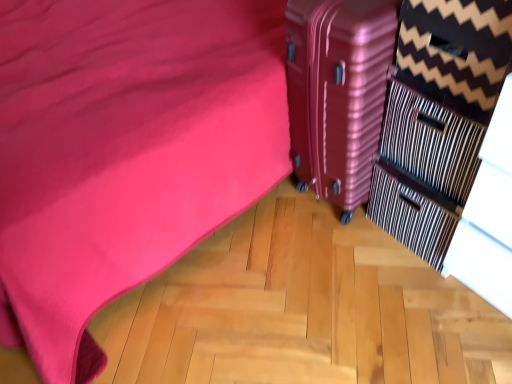
Locate an element on the screen. striped fabric dresser at right is located at coordinates (438, 118).

This screenshot has width=512, height=384. What do you see at coordinates (438, 118) in the screenshot?
I see `striped fabric dresser at right` at bounding box center [438, 118].

Measure the distance between metallic pink suitcase at right and camera.

38.86 inches.

This screenshot has width=512, height=384. Describe the element at coordinates (338, 92) in the screenshot. I see `metallic pink suitcase at right` at that location.

Locate an element on the screen. Image resolution: width=512 pixels, height=384 pixels. metallic pink suitcase at right is located at coordinates (338, 92).

You are a GUI agent. You are given a task and a screenshot of the screen. Output one action in this format:
    pyautogui.click(x=<x>, y=<y>)
    Task: Click on the striped fabric dresser at right
    This screenshot has height=384, width=512.
    Given the screenshot: What is the action you would take?
    pyautogui.click(x=438, y=118)

Looking at this image, considering the relative positions of metallic pink suitcase at right and striped fabric dresser at right in the image provided, is metallic pink suitcase at right to the left or to the right of striped fabric dresser at right?

Clearly, metallic pink suitcase at right is on the left of striped fabric dresser at right in the image.

Does metallic pink suitcase at right come behind striped fabric dresser at right?

That is True.

Does point (322, 98) appear closer or farther from the camera than point (442, 96)?

Clearly, point (322, 98) is more distant from the camera than point (442, 96).

From the image's perspective, is metallic pink suitcase at right on striped fabric dresser at right?

Yes, from the image's perspective, metallic pink suitcase at right is above striped fabric dresser at right.

From a real-world perspective, who is located lower, metallic pink suitcase at right or striped fabric dresser at right?

metallic pink suitcase at right, from a real-world perspective.

Does metallic pink suitcase at right have a greater width compared to striped fabric dresser at right?

Indeed, metallic pink suitcase at right has a greater width compared to striped fabric dresser at right.

Considering the relative sizes of metallic pink suitcase at right and striped fabric dresser at right in the image provided, is metallic pink suitcase at right shorter than striped fabric dresser at right?

In fact, metallic pink suitcase at right may be taller than striped fabric dresser at right.

Who is smaller, metallic pink suitcase at right or striped fabric dresser at right?

striped fabric dresser at right is smaller.

Looking at this image, is metallic pink suitcase at right located outside striped fabric dresser at right?

metallic pink suitcase at right lies outside striped fabric dresser at right's area.

Is metallic pink suitcase at right next to striped fabric dresser at right and touching it?

There is a gap between metallic pink suitcase at right and striped fabric dresser at right.

Is metallic pink suitcase at right oriented towards striped fabric dresser at right?

No.

How different are the orientations of metallic pink suitcase at right and striped fabric dresser at right in degrees?

The angular difference between metallic pink suitcase at right and striped fabric dresser at right is 0.000569 degrees.

Where is `suitcase above the striped fabric dresser at right (from the image's perspective)`? This screenshot has width=512, height=384. suitcase above the striped fabric dresser at right (from the image's perspective) is located at coordinates (338, 92).

Is striped fabric dresser at right at the right side of metallic pink suitcase at right?

Yes.

Who is more distant, striped fabric dresser at right or metallic pink suitcase at right?

metallic pink suitcase at right is further from the camera.

Considering the points (510, 48) and (366, 160), which point is behind, point (510, 48) or point (366, 160)?

Point (366, 160)

From the image's perspective, is striped fabric dresser at right above metallic pink suitcase at right?

No, from the image's perspective, striped fabric dresser at right is not over metallic pink suitcase at right.

From a real-world perspective, is striped fabric dresser at right over metallic pink suitcase at right?

Yes, from a real-world perspective, striped fabric dresser at right is above metallic pink suitcase at right.

Which object is wider, striped fabric dresser at right or metallic pink suitcase at right?

metallic pink suitcase at right is wider.

Does striped fabric dresser at right have a greater height compared to metallic pink suitcase at right?

No, striped fabric dresser at right is not taller than metallic pink suitcase at right.

Is striped fabric dresser at right bigger or smaller than metallic pink suitcase at right?

Considering their sizes, striped fabric dresser at right takes up less space than metallic pink suitcase at right.

Is metallic pink suitcase at right located within striped fabric dresser at right?

No, metallic pink suitcase at right is not inside striped fabric dresser at right.

Is striped fabric dresser at right placed right next to metallic pink suitcase at right?

striped fabric dresser at right and metallic pink suitcase at right are not in contact.

Looking at this image, is striped fabric dresser at right positioned with its back to metallic pink suitcase at right?

No, striped fabric dresser at right is not facing away from metallic pink suitcase at right.

How far apart are striped fabric dresser at right and metallic pink suitcase at right?

striped fabric dresser at right and metallic pink suitcase at right are 6.07 inches apart from each other.

You are a GUI agent. You are given a task and a screenshot of the screen. Output one action in this format:
    pyautogui.click(x=<x>, y=<y>)
    Task: Click on the dresser that is above the metallic pink suitcase at right (from a real-world perspective)
    The height and width of the screenshot is (384, 512).
    Given the screenshot: What is the action you would take?
    pyautogui.click(x=438, y=118)

Locate an element on the screen. This screenshot has width=512, height=384. dresser on the right of metallic pink suitcase at right is located at coordinates (438, 118).

Find the location of `dresser in front of the metallic pink suitcase at right`. dresser in front of the metallic pink suitcase at right is located at coordinates (438, 118).